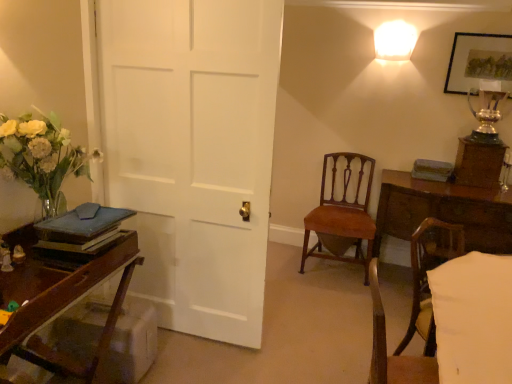
Question: Considering the positions of mahogany wood chair at center, placed as the second chair when sorted from front to back, and wooden picture frame at upper right in the image, is mahogany wood chair at center, placed as the second chair when sorted from front to back, taller or shorter than wooden picture frame at upper right?

Choices:
 (A) short
 (B) tall

Answer: (B)

Question: Considering their positions, is mahogany wood chair at center, placed as the second chair when sorted from front to back, located in front of or behind wooden picture frame at upper right?

Choices:
 (A) front
 (B) behind

Answer: (B)

Question: Which of these objects is positioned farthest from the mahogany wood chair at center, placed as the second chair when sorted from front to back?

Choices:
 (A) wooden table at right
 (B) wooden picture frame at upper right
 (C) white frosted glass sconce at upper right
 (D) silver metallic trophy at upper right
 (E) wooden desk at left

Answer: (E)

Question: Considering the real-world distances, which object is farthest from the mahogany wood chair at center, placed as the second chair when sorted from front to back?

Choices:
 (A) white frosted glass sconce at upper right
 (B) wooden desk at left
 (C) silver metallic trophy at upper right
 (D) wooden table at right
 (E) light brown wood chair at lower right, which is the second chair in back-to-front order

Answer: (B)